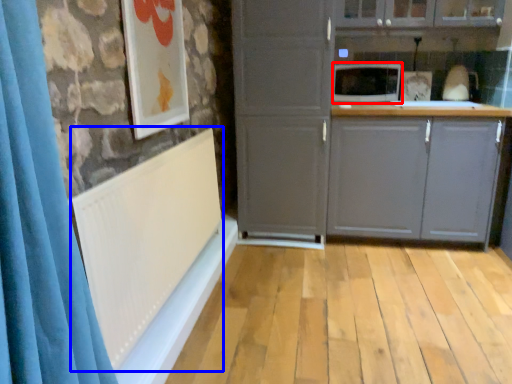
Question: Which point is closer to the camera, microwave oven (highlighted by a red box) or radiator (highlighted by a blue box)?

Choices:
 (A) microwave oven
 (B) radiator

Answer: (B)